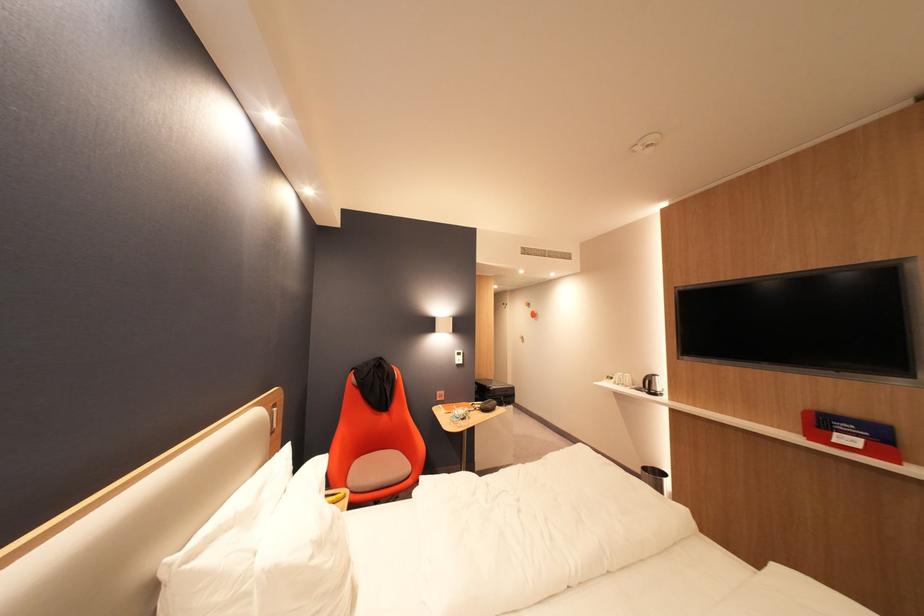
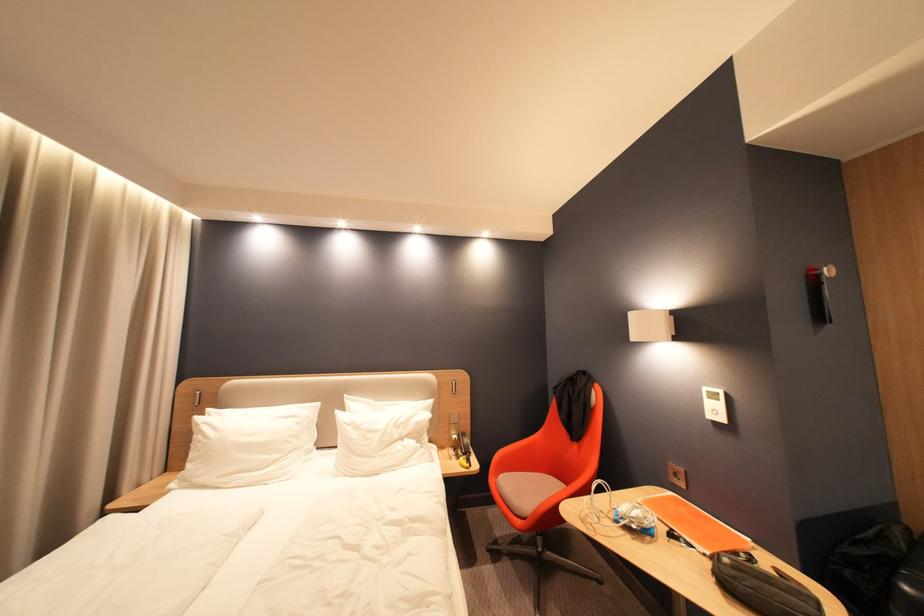
In the second image, find the point that corresponds to [483,411] in the first image.

(714, 556)